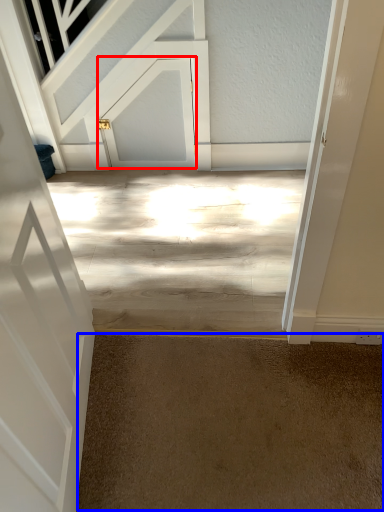
Question: Among these objects, which one is nearest to the camera, door (highlighted by a red box) or concrete (highlighted by a blue box)?

Choices:
 (A) door
 (B) concrete

Answer: (B)